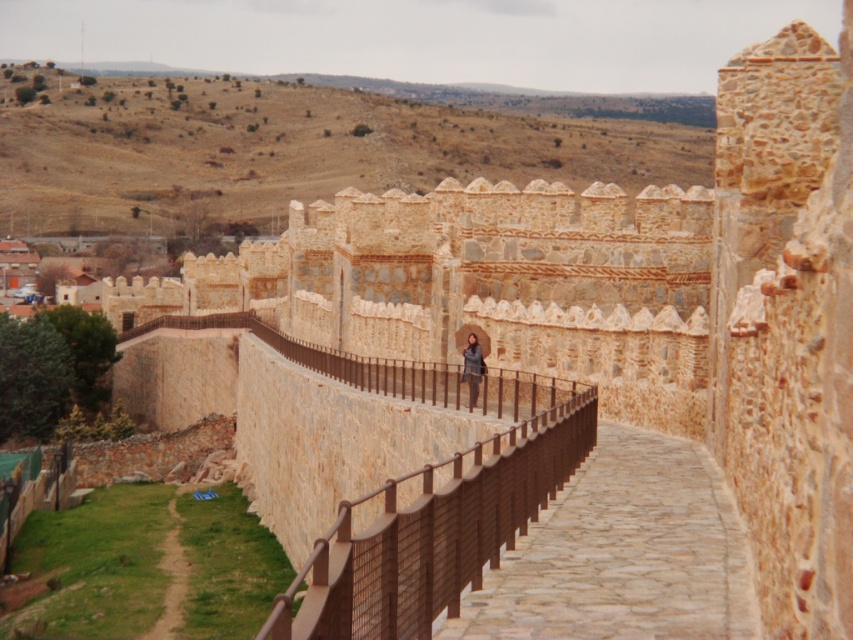
Question: Among these points, which one is nearest to the camera?

Choices:
 (A) (468, 396)
 (B) (701, 568)

Answer: (B)

Question: Does brown/dry grass at upper center have a greater width compared to dark gray leather jacket at center?

Choices:
 (A) yes
 (B) no

Answer: (A)

Question: Can you confirm if brown/dry grass at upper center is bigger than brown cobblestone path at center?

Choices:
 (A) yes
 (B) no

Answer: (A)

Question: Is brown metal/rail at center smaller than dark gray leather jacket at center?

Choices:
 (A) yes
 (B) no

Answer: (B)

Question: Which of these objects is positioned farthest from the brown metal/rail at center?

Choices:
 (A) brown/dry grass at upper center
 (B) brown cobblestone path at center
 (C) dark gray leather jacket at center

Answer: (A)

Question: Which point appears closest to the camera in this image?

Choices:
 (A) (471, 348)
 (B) (502, 589)

Answer: (B)